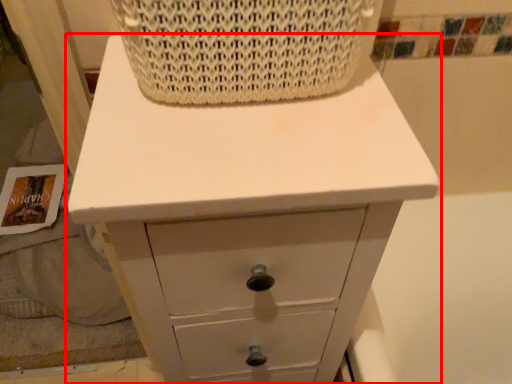
Question: From the image's perspective, where is chest of drawers (annotated by the red box) located relative to basket?

Choices:
 (A) above
 (B) below

Answer: (B)